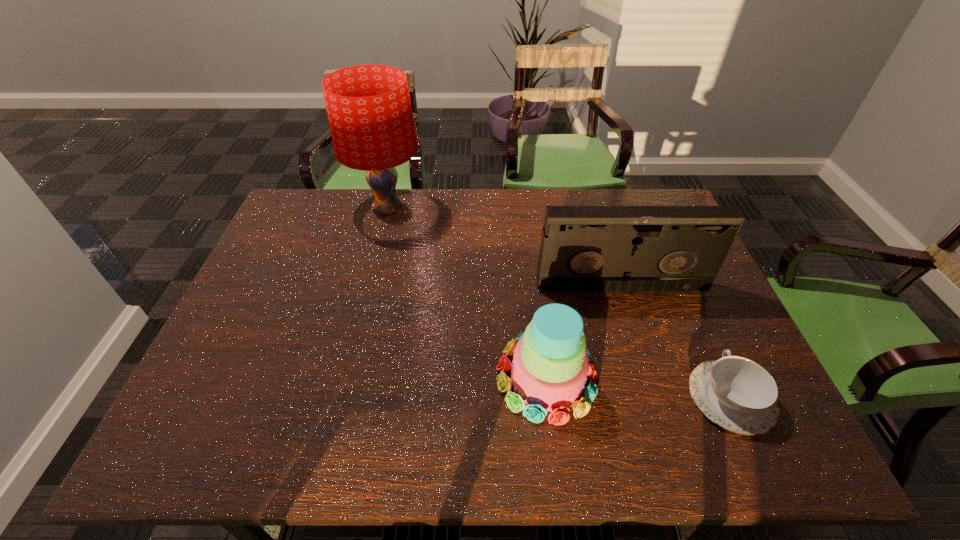
The height and width of the screenshot is (540, 960). Identify the location of vacant area that lies between the chinaware and the videotape. (676, 342).

Locate an element on the screen. The image size is (960, 540). empty space between the farthest object and the chinaware is located at coordinates (559, 303).

Where is `unoccupied position between the chinaware and the second shortest object`? This screenshot has height=540, width=960. unoccupied position between the chinaware and the second shortest object is located at coordinates (638, 388).

At what (x,y) coordinates should I click in order to perform the action: click on free spot between the videotape and the tallest object. Please return your answer as a coordinate pair (x, y). Looking at the image, I should click on (504, 247).

Find the location of a particular element. The width and height of the screenshot is (960, 540). free space that is in between the shortest object and the third nearest object is located at coordinates (676, 342).

Locate an element on the screen. the second closest object relative to the second shortest object is located at coordinates pos(736,393).

Locate an element on the screen. Image resolution: width=960 pixels, height=540 pixels. the closest object to the lampshade is located at coordinates (583, 248).

I want to click on free space in the image that satisfies the following two spatial constraints: 1. on the front-facing side of the third tallest object; 2. on the left side of the leftmost object, so click(x=346, y=377).

Locate an element on the screen. The width and height of the screenshot is (960, 540). free spot that satisfies the following two spatial constraints: 1. on the front-facing side of the cake; 2. on the right side of the farthest object is located at coordinates (346, 377).

Where is `free point that satisfies the following two spatial constraints: 1. on the handle side of the shortest object; 2. on the front-facing side of the tallest object`? This screenshot has height=540, width=960. free point that satisfies the following two spatial constraints: 1. on the handle side of the shortest object; 2. on the front-facing side of the tallest object is located at coordinates (646, 209).